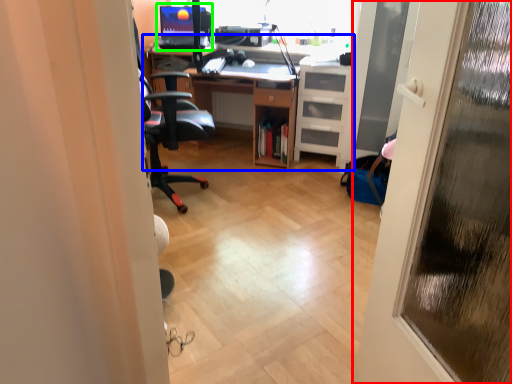
Question: Which object is the closest to the door (highlighted by a red box)? Choose among these: computer desk (highlighted by a blue box) or desktop computer (highlighted by a green box).

Choices:
 (A) computer desk
 (B) desktop computer

Answer: (A)